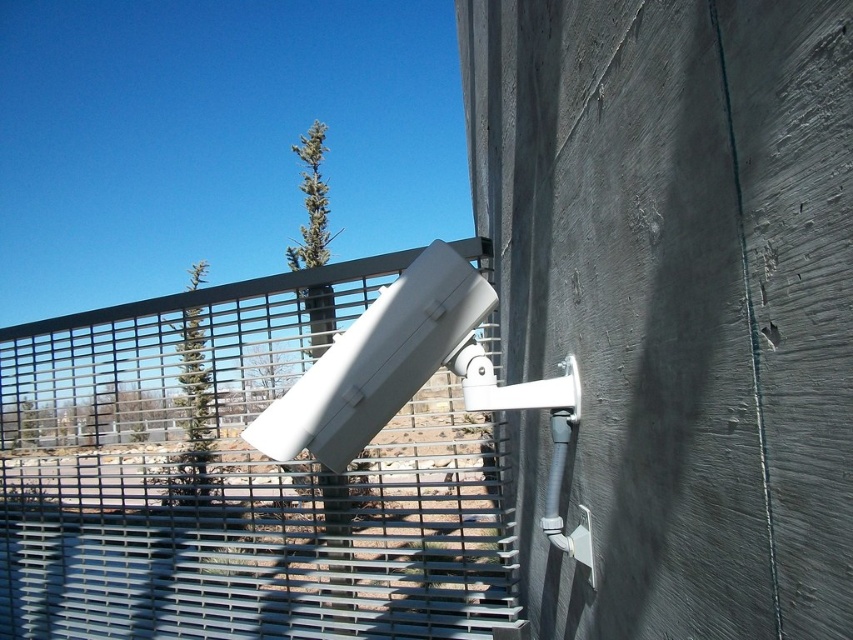
You are a security technician checking the installation of the camera. You notice the metallic gray fence at upper center and the gray metal blind at lower left. Which object is taller?

The metallic gray fence at upper center is much taller than the gray metal blind at lower left.

You are a security technician checking the installation of the camera. You notice two metal objects in the scene. Which one is larger between the metallic gray fence at upper center and the gray metal blind at lower left?

The metallic gray fence at upper center is bigger than the gray metal blind at lower left.